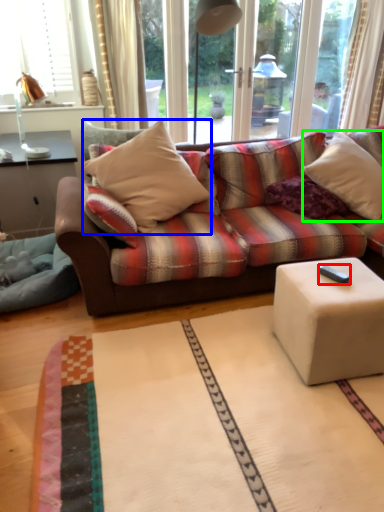
Question: Estimate the real-world distances between objects in this image. Which object is farther from remote control (highlighted by a red box), pillow (highlighted by a blue box) or pillow (highlighted by a green box)?

Choices:
 (A) pillow
 (B) pillow

Answer: (A)